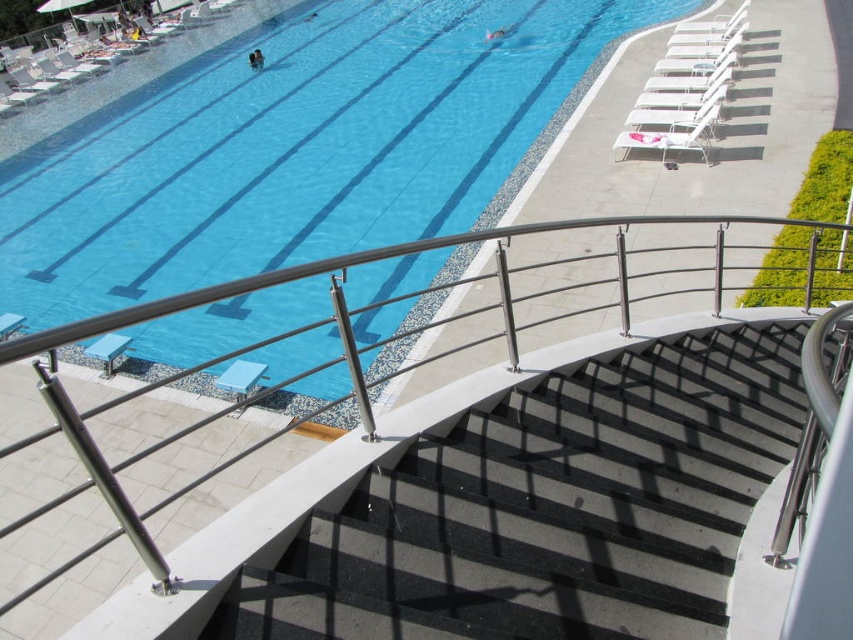
The height and width of the screenshot is (640, 853). What are the coordinates of `blue glossy water at upper center` in the screenshot? It's located at (316, 150).

Can you confirm if blue glossy water at upper center is wider than black textured stairs at center?

Correct, the width of blue glossy water at upper center exceeds that of black textured stairs at center.

Between point (433, 208) and point (792, 353), which one is positioned behind?

Point (433, 208)

You are a GUI agent. You are given a task and a screenshot of the screen. Output one action in this format:
    pyautogui.click(x=<x>, y=<y>)
    Task: Click on the blue glossy water at upper center
    
    Given the screenshot: What is the action you would take?
    pyautogui.click(x=316, y=150)

Who is positioned more to the right, black textured stairs at center or white plastic lounge chair at upper right?

From the viewer's perspective, white plastic lounge chair at upper right appears more on the right side.

This screenshot has height=640, width=853. Describe the element at coordinates (550, 508) in the screenshot. I see `black textured stairs at center` at that location.

Locate an element on the screen. The image size is (853, 640). black textured stairs at center is located at coordinates (550, 508).

Between blue glossy water at upper center and white plastic lounge chair at upper right, which one has more height?

Standing taller between the two is blue glossy water at upper center.

Does blue glossy water at upper center appear on the right side of white plastic lounge chair at upper right?

No, blue glossy water at upper center is not to the right of white plastic lounge chair at upper right.

Does point (276, 253) lie behind point (723, 44)?

No, (276, 253) is closer to viewer.

Find the location of a particular element. blue glossy water at upper center is located at coordinates (316, 150).